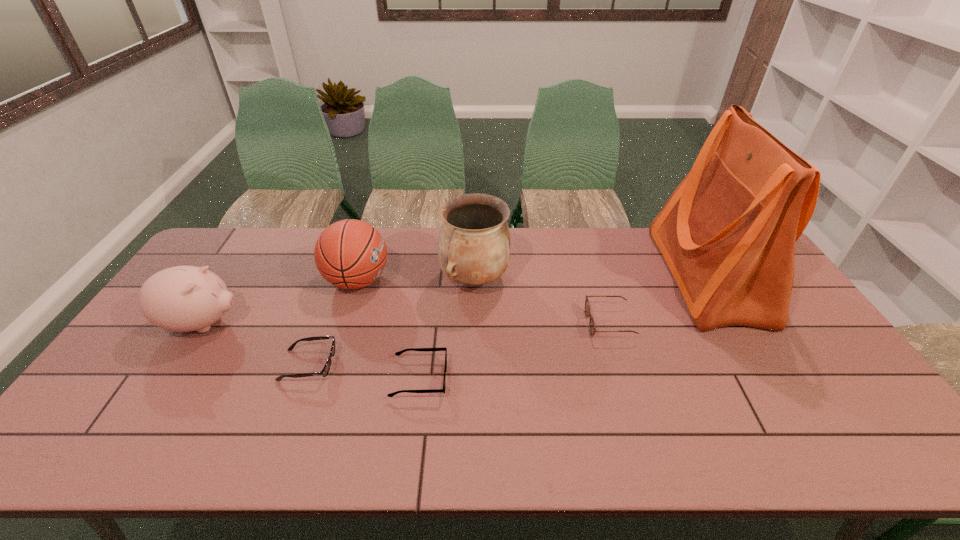
Find the location of a particular element. free location located on the front pocket of the tallest object is located at coordinates (647, 276).

Where is `vacant region located 0.300m on the front pocket of the tallest object`? The image size is (960, 540). vacant region located 0.300m on the front pocket of the tallest object is located at coordinates (571, 276).

Identify the location of vacant point located 0.070m on the front of the urn. This screenshot has width=960, height=540. (473, 321).

Identify the location of blank space located 0.120m on the logo side of the basketball. The image size is (960, 540). (428, 281).

Identify the location of free space located 0.230m at the snout of the leftmost object. (323, 323).

The height and width of the screenshot is (540, 960). Identify the location of free spot located at the front view of the rightmost spectacles. (546, 323).

The height and width of the screenshot is (540, 960). Identify the location of vacant point located at the front view of the rightmost spectacles. pyautogui.click(x=498, y=323).

Where is `blank space located at the front view of the rightmost spectacles`? blank space located at the front view of the rightmost spectacles is located at coordinates (498, 323).

Where is `free space located 0.330m on the lenses of the leftmost spectacles`? The width and height of the screenshot is (960, 540). free space located 0.330m on the lenses of the leftmost spectacles is located at coordinates (459, 365).

This screenshot has height=540, width=960. What are the coordinates of `free space located 0.370m on the arms of the second spectacles from left to right` in the screenshot? It's located at (588, 379).